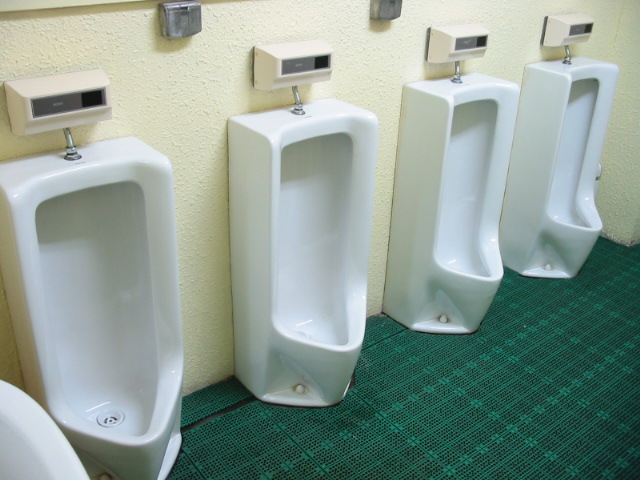
Image resolution: width=640 pixels, height=480 pixels. Identify the location of urinals. (134, 277), (313, 240), (465, 171), (572, 159).